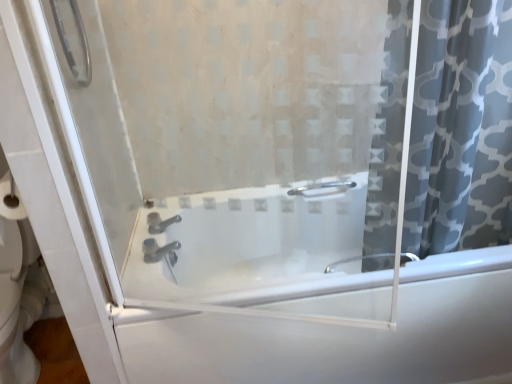
Find the location of a particular element. The height and width of the screenshot is (384, 512). white glossy bathtub at center is located at coordinates (251, 248).

Is satin nickel faucet at center outside of gray patterned fabric at right?

satin nickel faucet at center is positioned outside gray patterned fabric at right.

Which is in front, point (151, 260) or point (402, 117)?

Positioned in front is point (402, 117).

The image size is (512, 384). What are the coordinates of `curtain in front of the satin nickel faucet at center` in the screenshot? It's located at (461, 129).

Is white glossy bathtub at center taller or shorter than gray patterned fabric at right?

Clearly, white glossy bathtub at center is shorter compared to gray patterned fabric at right.

Would you say gray patterned fabric at right is part of white glossy bathtub at center's contents?

No, gray patterned fabric at right is located outside of white glossy bathtub at center.

Is white glossy bathtub at center bigger or smaller than gray patterned fabric at right?

Considering their sizes, white glossy bathtub at center takes up more space than gray patterned fabric at right.

Is white glossy bathtub at center in front of gray patterned fabric at right?

No, white glossy bathtub at center is behind gray patterned fabric at right.

Are satin nickel faucet at center and white glossy bathtub at center making contact?

No, satin nickel faucet at center is not touching white glossy bathtub at center.

Do you think satin nickel faucet at center is within white glossy bathtub at center, or outside of it?

satin nickel faucet at center is not enclosed by white glossy bathtub at center.

From the image's perspective, who appears lower, satin nickel faucet at center or white glossy bathtub at center?

white glossy bathtub at center.

Based on the photo, considering the sizes of gray patterned fabric at right and white glossy bathtub at center in the image, is gray patterned fabric at right wider or thinner than white glossy bathtub at center?

Clearly, gray patterned fabric at right has less width compared to white glossy bathtub at center.

Considering the relative sizes of gray patterned fabric at right and white glossy bathtub at center in the image provided, is gray patterned fabric at right bigger than white glossy bathtub at center?

No.

Considering the relative positions of gray patterned fabric at right and white glossy bathtub at center in the image provided, is gray patterned fabric at right in front of white glossy bathtub at center?

Yes, gray patterned fabric at right is in front of white glossy bathtub at center.

Between point (508, 42) and point (254, 303), which one is positioned behind?

Positioned behind is point (254, 303).

Between point (228, 301) and point (157, 256), which one is positioned in front?

The point (228, 301) is closer.

Who is shorter, white glossy bathtub at center or satin nickel faucet at center?

Standing shorter between the two is satin nickel faucet at center.

Between white glossy bathtub at center and satin nickel faucet at center, which one has larger width?

With larger width is white glossy bathtub at center.

Could you tell me if white glossy bathtub at center is facing satin nickel faucet at center?

No, white glossy bathtub at center is not turned towards satin nickel faucet at center.

Which of these two, gray patterned fabric at right or satin nickel faucet at center, is wider?

gray patterned fabric at right is wider.

Is gray patterned fabric at right positioned in front of satin nickel faucet at center?

Yes, the depth of gray patterned fabric at right is less than that of satin nickel faucet at center.

From a real-world perspective, is gray patterned fabric at right beneath satin nickel faucet at center?

No, from a real-world perspective, gray patterned fabric at right is not below satin nickel faucet at center.

Is gray patterned fabric at right looking in the opposite direction of satin nickel faucet at center?

No, gray patterned fabric at right's orientation is not away from satin nickel faucet at center.

I want to click on tap below the gray patterned fabric at right (from the image's perspective), so click(x=159, y=251).

Where is `curtain lying on the right of white glossy bathtub at center`? This screenshot has width=512, height=384. curtain lying on the right of white glossy bathtub at center is located at coordinates (461, 129).

Consider the image. Which object lies nearer to the anchor point satin nickel faucet at center, gray patterned fabric at right or white glossy bathtub at center?

white glossy bathtub at center is positioned closer to the anchor satin nickel faucet at center.

Looking at the image, which one is located further to white glossy bathtub at center, gray patterned fabric at right or satin nickel faucet at center?

The object further to white glossy bathtub at center is satin nickel faucet at center.

Estimate the real-world distances between objects in this image. Which object is closer to white glossy bathtub at center, satin nickel faucet at center or gray patterned fabric at right?

The object closer to white glossy bathtub at center is gray patterned fabric at right.

From the image, which object appears to be farther from gray patterned fabric at right, satin nickel faucet at center or white glossy bathtub at center?

Based on the image, satin nickel faucet at center appears to be further to gray patterned fabric at right.

From the image, which object appears to be farther from satin nickel faucet at center, white glossy bathtub at center or gray patterned fabric at right?

Among the two, gray patterned fabric at right is located further to satin nickel faucet at center.

Consider the image. From the image, which object appears to be nearer to gray patterned fabric at right, white glossy bathtub at center or satin nickel faucet at center?

white glossy bathtub at center is positioned closer to the anchor gray patterned fabric at right.

Locate an element on the screen. Image resolution: width=512 pixels, height=384 pixels. bathtub situated between satin nickel faucet at center and gray patterned fabric at right from left to right is located at coordinates (251, 248).